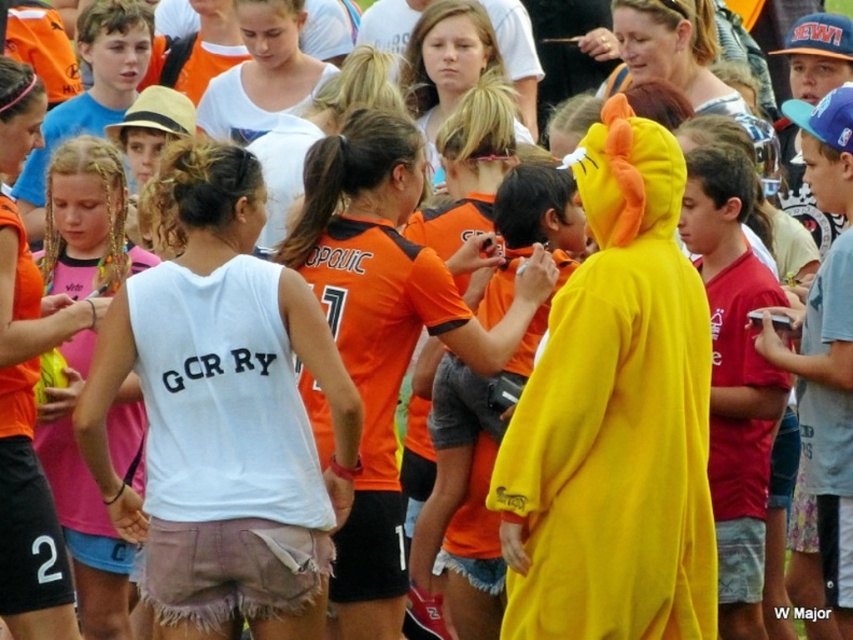
Is orange jersey at center wider than matte pink shirt at center?

Indeed, orange jersey at center has a greater width compared to matte pink shirt at center.

How far apart are orange jersey at center and matte pink shirt at center?

orange jersey at center is 4.34 meters away from matte pink shirt at center.

This screenshot has width=853, height=640. I want to click on orange jersey at center, so click(384, 332).

Where is `orange jersey at center`? The width and height of the screenshot is (853, 640). orange jersey at center is located at coordinates (384, 332).

Who is positioned more to the left, white cotton tank top at center or matte pink shirt at center?

matte pink shirt at center is more to the left.

Can you confirm if white cotton tank top at center is taller than matte pink shirt at center?

Indeed, white cotton tank top at center has a greater height compared to matte pink shirt at center.

Is point (215, 506) positioned behind point (108, 184)?

No.

Find the location of a particular element. Image resolution: width=853 pixels, height=640 pixels. white cotton tank top at center is located at coordinates click(x=219, y=368).

Does orange jersey at center appear on the left side of red cotton shirt at right?

Yes, orange jersey at center is to the left of red cotton shirt at right.

Can you confirm if orange jersey at center is smaller than red cotton shirt at right?

Yes.

What do you see at coordinates (384, 332) in the screenshot?
I see `orange jersey at center` at bounding box center [384, 332].

Where is `orange jersey at center`? The height and width of the screenshot is (640, 853). orange jersey at center is located at coordinates (384, 332).